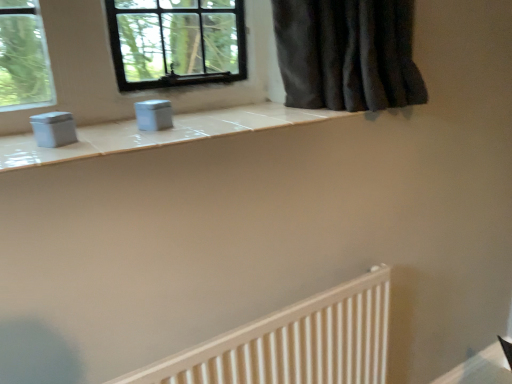
The image size is (512, 384). Identify the location of matte plastic container at center. (154, 115).

In order to face matte plastic container at center, should I rotate leftwards or rightwards?

Rotate your view left by about 12.613°.

What do you see at coordinates (154, 115) in the screenshot? I see `matte plastic container at center` at bounding box center [154, 115].

This screenshot has width=512, height=384. What do you see at coordinates (294, 343) in the screenshot? I see `white wooden radiator at lower right` at bounding box center [294, 343].

Find the location of a particular element. The width and height of the screenshot is (512, 384). white wooden radiator at lower right is located at coordinates (294, 343).

Image resolution: width=512 pixels, height=384 pixels. What are the coordinates of `matte plastic container at center` in the screenshot? It's located at (154, 115).

Would you say white wooden radiator at lower right is to the left or to the right of matte plastic container at center in the picture?

Based on their positions, white wooden radiator at lower right is located to the right of matte plastic container at center.

Which is behind, white wooden radiator at lower right or matte plastic container at center?

matte plastic container at center.

Does point (386, 349) lie in front of point (164, 104)?

No, (386, 349) is further to viewer.

In the scene shown: From the image's perspective, which one is positioned lower, white wooden radiator at lower right or matte plastic container at center?

white wooden radiator at lower right appears lower in the image.

From a real-world perspective, which object rests below the other?

white wooden radiator at lower right is physically lower.

From the picture: Looking at their sizes, would you say white wooden radiator at lower right is wider or thinner than matte plastic container at center?

white wooden radiator at lower right is wider than matte plastic container at center.

Considering the relative sizes of white wooden radiator at lower right and matte plastic container at center in the image provided, is white wooden radiator at lower right taller than matte plastic container at center?

Yes, white wooden radiator at lower right is taller than matte plastic container at center.

Does white wooden radiator at lower right have a smaller size compared to matte plastic container at center?

Incorrect, white wooden radiator at lower right is not smaller in size than matte plastic container at center.

Is white wooden radiator at lower right positioned beyond the bounds of matte plastic container at center?

white wooden radiator at lower right lies outside matte plastic container at center's area.

Is white wooden radiator at lower right beside matte plastic container at center?

No, white wooden radiator at lower right is not with matte plastic container at center.

Is matte plastic container at center at the back of white wooden radiator at lower right?

No, white wooden radiator at lower right's orientation is not away from matte plastic container at center.

How many degrees apart are the facing directions of white wooden radiator at lower right and matte plastic container at center?

1.54 degrees.

This screenshot has height=384, width=512. I want to click on gray lying behind the white wooden radiator at lower right, so tap(154, 115).

Visually, is matte plastic container at center positioned to the left or to the right of white wooden radiator at lower right?

Based on their positions, matte plastic container at center is located to the left of white wooden radiator at lower right.

Which object is more forward, matte plastic container at center or white wooden radiator at lower right?

Positioned in front is white wooden radiator at lower right.

Is point (155, 115) farther from viewer compared to point (285, 309)?

No, it is in front of (285, 309).

From the image's perspective, which object appears higher, matte plastic container at center or white wooden radiator at lower right?

From the image's view, matte plastic container at center is above.

From the picture: From a real-world perspective, is matte plastic container at center below white wooden radiator at lower right?

No, from a real-world perspective, matte plastic container at center is not under white wooden radiator at lower right.

Is matte plastic container at center wider than white wooden radiator at lower right?

Incorrect, the width of matte plastic container at center does not surpass that of white wooden radiator at lower right.

Is matte plastic container at center taller than white wooden radiator at lower right?

No, matte plastic container at center is not taller than white wooden radiator at lower right.

Can you confirm if matte plastic container at center is bigger than white wooden radiator at lower right?

No.

Which is correct: matte plastic container at center is inside white wooden radiator at lower right, or outside of it?

matte plastic container at center exists outside the volume of white wooden radiator at lower right.

Would you consider matte plastic container at center to be distant from white wooden radiator at lower right?

No, matte plastic container at center is not far from white wooden radiator at lower right.

Is matte plastic container at center positioned with its back to white wooden radiator at lower right?

No, matte plastic container at center's orientation is not away from white wooden radiator at lower right.

How different are the orientations of matte plastic container at center and white wooden radiator at lower right in degrees?

The angular difference between matte plastic container at center and white wooden radiator at lower right is 1.54 degrees.

At what (x,y) coordinates should I click in order to perform the action: click on gray behind the white wooden radiator at lower right. Please return your answer as a coordinate pair (x, y). Image resolution: width=512 pixels, height=384 pixels. Looking at the image, I should click on (154, 115).

I want to click on radiator below the matte plastic container at center (from a real-world perspective), so pyautogui.click(x=294, y=343).

Where is `radiator on the right of matte plastic container at center`? Image resolution: width=512 pixels, height=384 pixels. radiator on the right of matte plastic container at center is located at coordinates pyautogui.click(x=294, y=343).